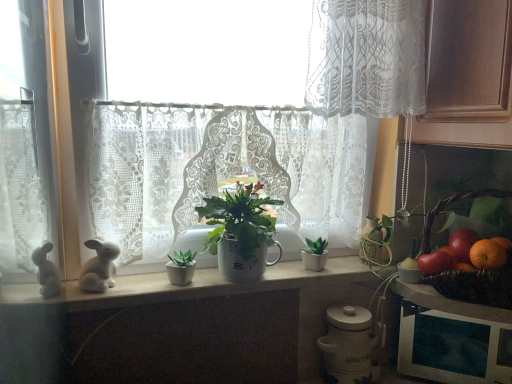
Question: Is white lace curtain at center, arranged as the second curtain when viewed from the right, thinner than white matte counter top at center?

Choices:
 (A) yes
 (B) no

Answer: (A)

Question: Is white lace curtain at center, which appears as the 1th curtain when viewed from the left, shorter than white matte counter top at center?

Choices:
 (A) no
 (B) yes

Answer: (A)

Question: Can we say white lace curtain at center, which is the first curtain in bottom-to-top order, lies outside white matte counter top at center?

Choices:
 (A) yes
 (B) no

Answer: (A)

Question: Is white lace curtain at center, arranged as the second curtain when viewed from the right, facing towards white matte counter top at center?

Choices:
 (A) no
 (B) yes

Answer: (A)

Question: Does white lace curtain at center, the second curtain positioned from the top, have a smaller size compared to white matte counter top at center?

Choices:
 (A) no
 (B) yes

Answer: (A)

Question: Is white lace curtain at center, the second curtain positioned from the top, positioned with its back to white matte counter top at center?

Choices:
 (A) no
 (B) yes

Answer: (A)

Question: Considering the relative sizes of white lace curtain at upper center, placed as the first curtain when sorted from top to bottom, and shiny red tomato at right, which appears as the 2th fruit when viewed from the right, in the image provided, is white lace curtain at upper center, placed as the first curtain when sorted from top to bottom, bigger than shiny red tomato at right, which appears as the 2th fruit when viewed from the right,?

Choices:
 (A) yes
 (B) no

Answer: (A)

Question: Can shiny red tomato at right, which appears as the 2th fruit when viewed from the right, be found inside white lace curtain at upper center, the second curtain positioned from the bottom?

Choices:
 (A) no
 (B) yes

Answer: (A)

Question: From the image's perspective, is white lace curtain at upper center, the second curtain positioned from the left, above shiny red tomato at right, which appears as the 2th fruit when viewed from the right?

Choices:
 (A) yes
 (B) no

Answer: (A)

Question: Is white lace curtain at upper center, placed as the first curtain when sorted from top to bottom, looking in the opposite direction of shiny red tomato at right, which ranks as the first fruit in left-to-right order?

Choices:
 (A) no
 (B) yes

Answer: (A)

Question: Are white lace curtain at upper center, the second curtain positioned from the left, and shiny red tomato at right, which ranks as the first fruit in left-to-right order, making contact?

Choices:
 (A) no
 (B) yes

Answer: (A)

Question: Is white lace curtain at upper center, the second curtain positioned from the left, located outside shiny red tomato at right, which appears as the 2th fruit when viewed from the right?

Choices:
 (A) yes
 (B) no

Answer: (A)

Question: Is white lace curtain at center, which is the first curtain in bottom-to-top order, aimed at brown woven basket at right?

Choices:
 (A) yes
 (B) no

Answer: (B)